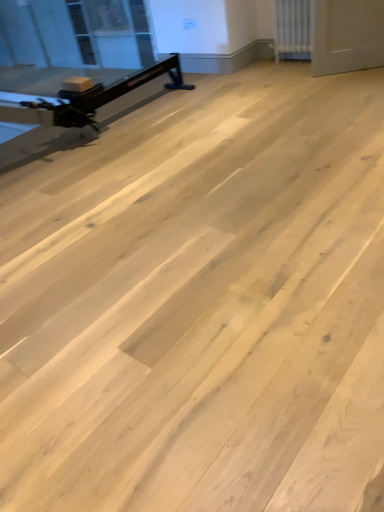
The height and width of the screenshot is (512, 384). What do you see at coordinates (83, 97) in the screenshot? I see `matte black exercise bike at left` at bounding box center [83, 97].

Find the location of a particular element. The height and width of the screenshot is (512, 384). white textured radiator at upper right is located at coordinates (292, 29).

Does white textured radiator at upper right turn towards transparent glass window screen at upper left?

No, white textured radiator at upper right is not facing towards transparent glass window screen at upper left.

You are a GUI agent. You are given a task and a screenshot of the screen. Output one action in this format:
    pyautogui.click(x=<x>, y=<y>)
    Task: Click on the radiator that is on the right side of transparent glass window screen at upper left
    This screenshot has height=512, width=384.
    Given the screenshot: What is the action you would take?
    pyautogui.click(x=292, y=29)

From the image's perspective, which is above, white textured radiator at upper right or transparent glass window screen at upper left?

transparent glass window screen at upper left is shown above in the image.

Would you say white textured radiator at upper right is a long distance from transparent glass window screen at upper left?

Yes, white textured radiator at upper right and transparent glass window screen at upper left are quite far apart.

From a real-world perspective, is matte black exercise bike at left physically located above or below white textured radiator at upper right?

From a real-world perspective, matte black exercise bike at left is physically above white textured radiator at upper right.

Does matte black exercise bike at left turn towards white textured radiator at upper right?

Yes, matte black exercise bike at left faces towards white textured radiator at upper right.

Which of these two, matte black exercise bike at left or white textured radiator at upper right, is smaller?

matte black exercise bike at left is smaller.

Looking at their sizes, would you say matte black exercise bike at left is wider or thinner than white textured radiator at upper right?

matte black exercise bike at left is thinner than white textured radiator at upper right.

The width and height of the screenshot is (384, 512). Identify the location of furniture to the right of transparent glass window screen at upper left. (83, 97).

From the image's perspective, relative to transparent glass window screen at upper left, is matte black exercise bike at left above or below?

From the image's perspective, matte black exercise bike at left appears below transparent glass window screen at upper left.

Is matte black exercise bike at left in contact with transparent glass window screen at upper left?

No.

Considering the relative sizes of matte black exercise bike at left and transparent glass window screen at upper left in the image provided, is matte black exercise bike at left thinner than transparent glass window screen at upper left?

Correct, the width of matte black exercise bike at left is less than that of transparent glass window screen at upper left.

Does white textured radiator at upper right touch matte black exercise bike at left?

No.

How much distance is there between white textured radiator at upper right and matte black exercise bike at left?

white textured radiator at upper right is 4.53 feet from matte black exercise bike at left.

From the image's perspective, which one is positioned higher, white textured radiator at upper right or matte black exercise bike at left?

From the image's view, white textured radiator at upper right is above.

Which object is wider, white textured radiator at upper right or matte black exercise bike at left?

With larger width is white textured radiator at upper right.

Would you consider transparent glass window screen at upper left to be distant from matte black exercise bike at left?

Yes, transparent glass window screen at upper left and matte black exercise bike at left are located far from each other.

Between transparent glass window screen at upper left and matte black exercise bike at left, which one has more height?

With more height is transparent glass window screen at upper left.

From a real-world perspective, which is physically above, transparent glass window screen at upper left or matte black exercise bike at left?

matte black exercise bike at left is physically above.

Consider the image. From a real-world perspective, is transparent glass window screen at upper left positioned above or below white textured radiator at upper right?

Clearly, from a real-world perspective, transparent glass window screen at upper left is below white textured radiator at upper right.

Based on their sizes in the image, would you say transparent glass window screen at upper left is bigger or smaller than white textured radiator at upper right?

Clearly, transparent glass window screen at upper left is larger in size than white textured radiator at upper right.

Is transparent glass window screen at upper left taller or shorter than white textured radiator at upper right?

Clearly, transparent glass window screen at upper left is taller compared to white textured radiator at upper right.

Which object is further away from the camera taking this photo, transparent glass window screen at upper left or white textured radiator at upper right?

Positioned behind is transparent glass window screen at upper left.

Find the location of a particular element. The height and width of the screenshot is (512, 384). window screen lying on the left of white textured radiator at upper right is located at coordinates (112, 32).

Identify the location of furniture below the white textured radiator at upper right (from the image's perspective). This screenshot has height=512, width=384. (83, 97).

Considering their positions, is transparent glass window screen at upper left positioned closer to matte black exercise bike at left than white textured radiator at upper right?

white textured radiator at upper right is positioned closer to the anchor matte black exercise bike at left.

Which object lies nearer to the anchor point transparent glass window screen at upper left, white textured radiator at upper right or matte black exercise bike at left?

matte black exercise bike at left is closer to transparent glass window screen at upper left.

Based on their spatial positions, is white textured radiator at upper right or transparent glass window screen at upper left further from matte black exercise bike at left?

transparent glass window screen at upper left.

From the image, which object appears to be nearer to transparent glass window screen at upper left, matte black exercise bike at left or white textured radiator at upper right?

matte black exercise bike at left lies closer to transparent glass window screen at upper left than the other object.

From the image, which object appears to be nearer to white textured radiator at upper right, matte black exercise bike at left or transparent glass window screen at upper left?

matte black exercise bike at left is closer to white textured radiator at upper right.

Which object lies further to the anchor point white textured radiator at upper right, transparent glass window screen at upper left or matte black exercise bike at left?

The object further to white textured radiator at upper right is transparent glass window screen at upper left.

The height and width of the screenshot is (512, 384). I want to click on radiator located between matte black exercise bike at left and transparent glass window screen at upper left in the depth direction, so point(292,29).